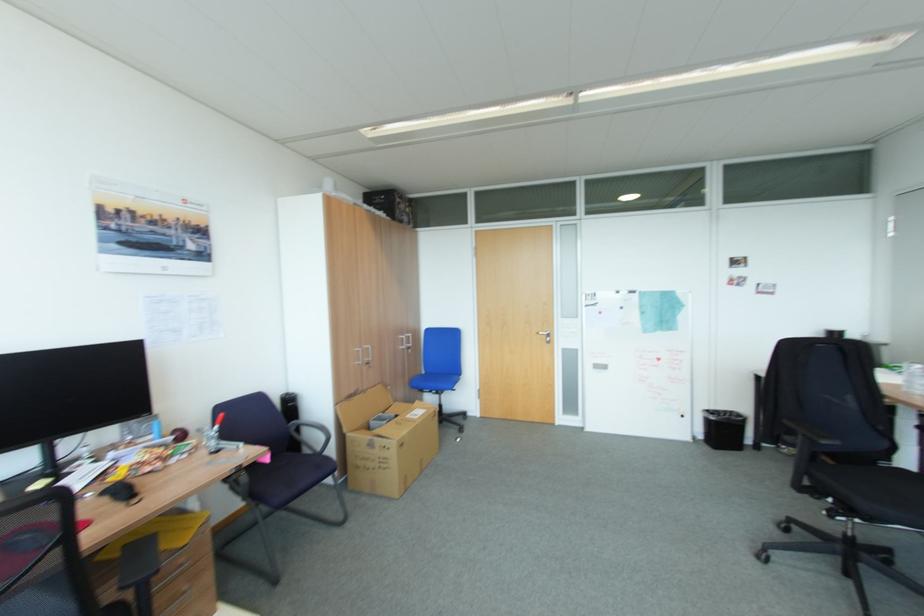
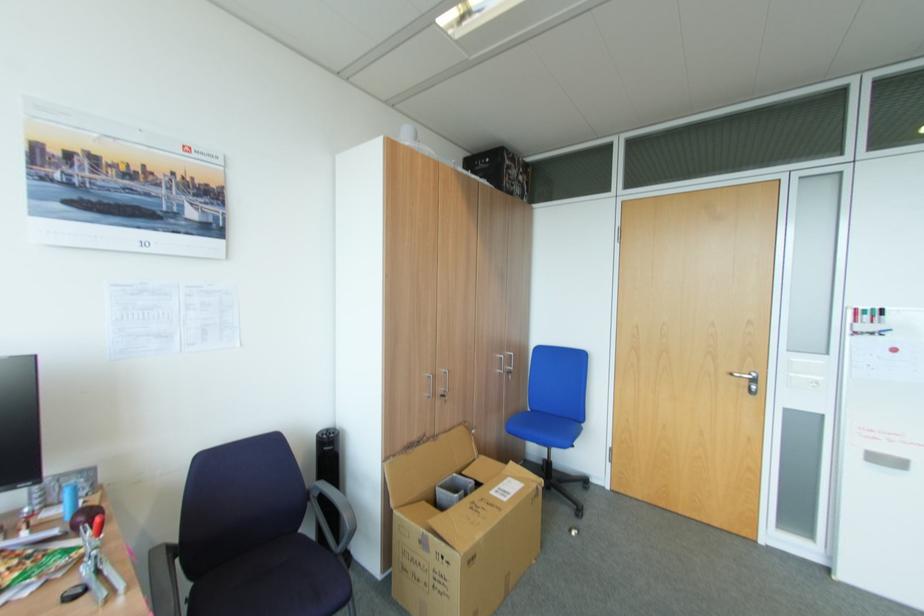
Locate, in the second image, the point that corresponds to (x=590, y=305) in the first image.

(856, 333)